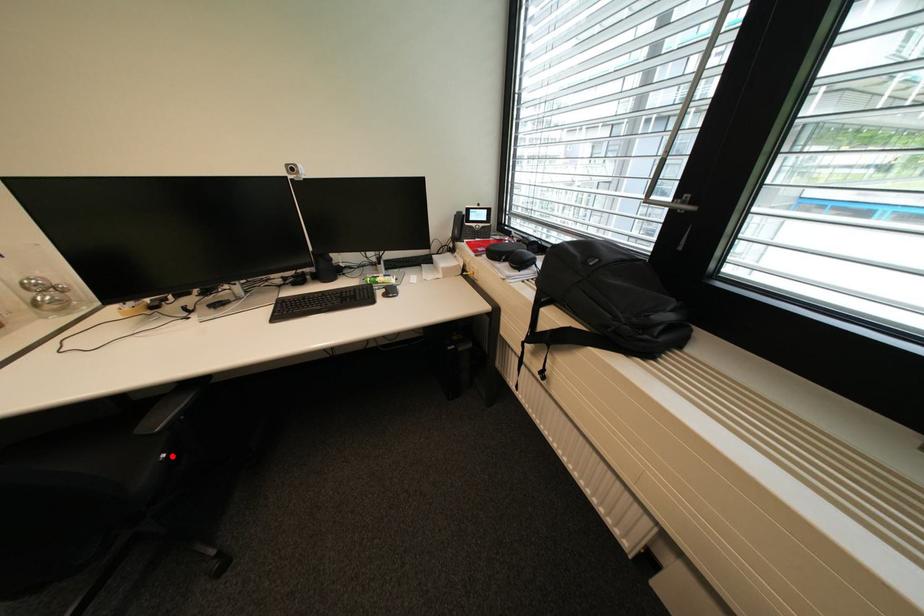
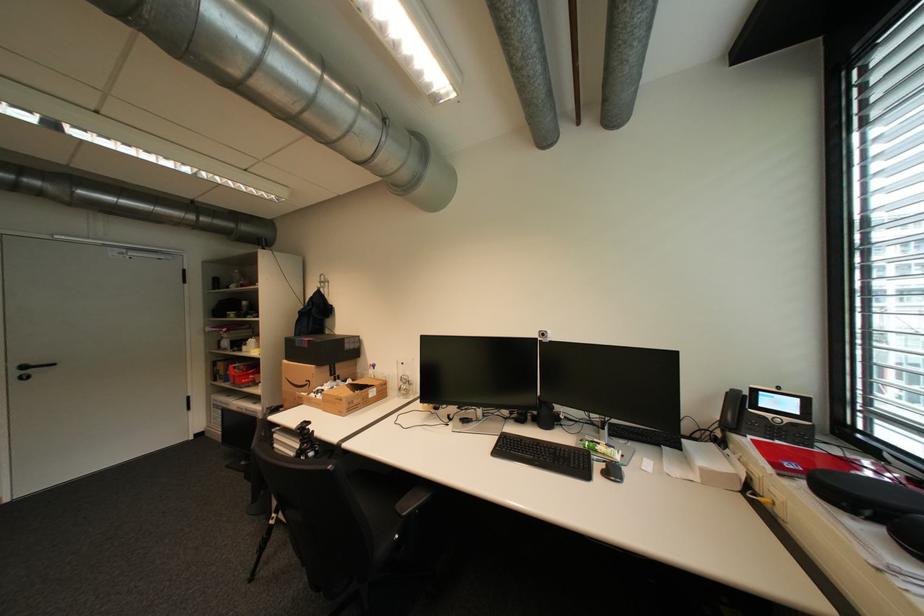
Where in the second image is the point corresponding to the highlighted location from the first image?

(406, 537)